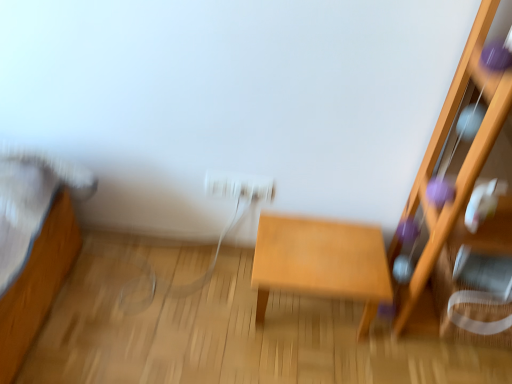
Locate an element on the screen. The image size is (512, 384). free region under light brown wooden table at center (from a real-world perspective) is located at coordinates (312, 312).